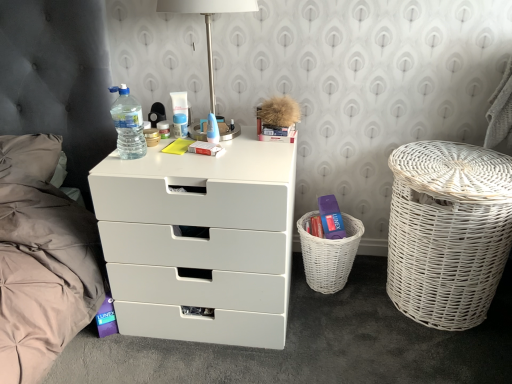
The height and width of the screenshot is (384, 512). Find the location of `vacant space behind blue plastic container at center, arranged as the third toiletry when viewed from the left`. vacant space behind blue plastic container at center, arranged as the third toiletry when viewed from the left is located at coordinates (184, 120).